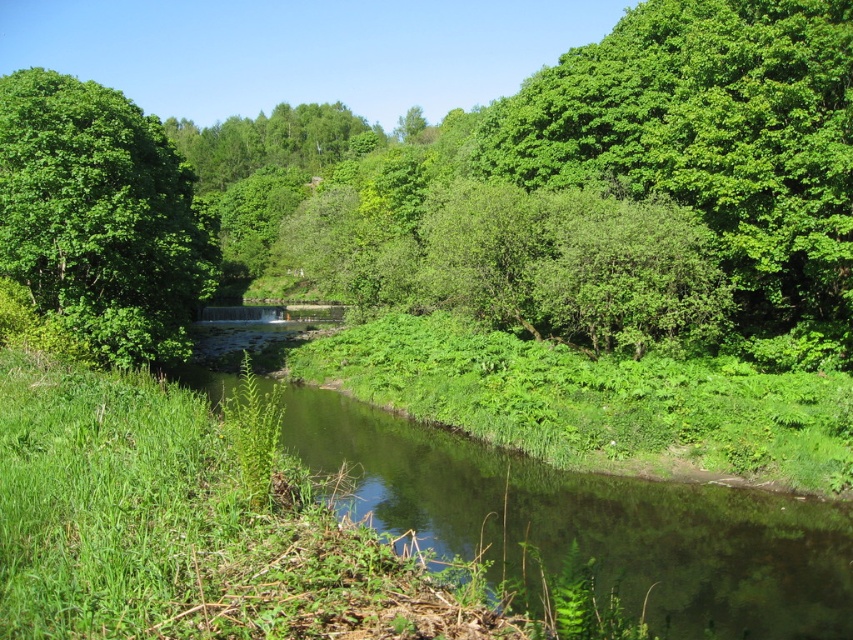
You are a photographer standing in the grassy area with wildflowers. You want to capture a photo that includes both the clear water at center and the green leafy tree at upper left. Which object should you position on the left side of your camera frame?

The green leafy tree at upper left should be positioned on the left side of your camera frame because the clear water at center is on its right side.

You are standing at the point with coordinates [595,524] in the serene natural landscape. What do you see immediately around you?

You see clear water at center around the point [595,524].